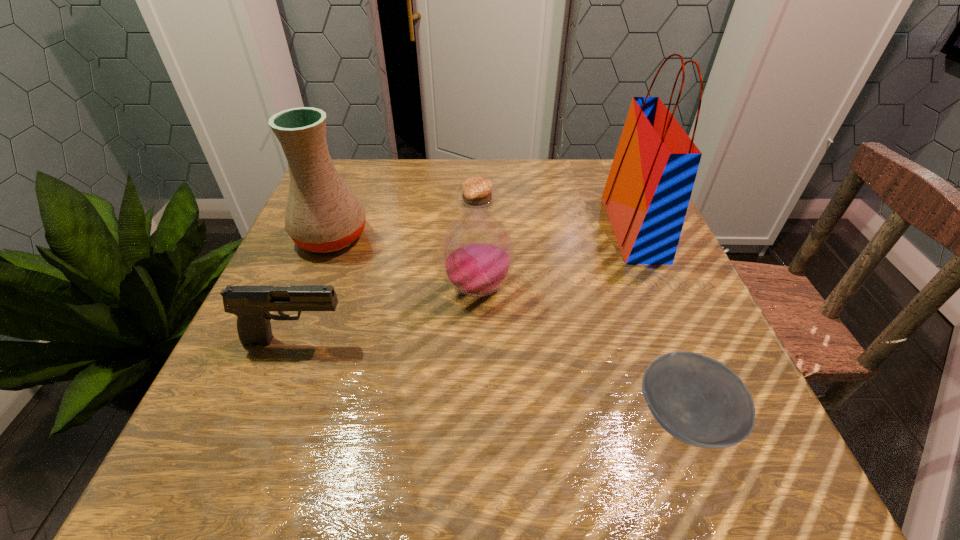
The height and width of the screenshot is (540, 960). In order to click on vacant point located between the shopping bag and the bowl in this screenshot , I will do 659,323.

This screenshot has height=540, width=960. What are the coordinates of `blank region between the third nearest object and the second nearest object` in the screenshot? It's located at (387, 314).

I want to click on free spot between the bowl and the tallest object, so click(x=659, y=323).

Find the location of a particular element. The image size is (960, 540). vacant area that lies between the pistol and the third tallest object is located at coordinates (387, 314).

What are the coordinates of `unoccupied position between the third object from left to right and the pottery` in the screenshot? It's located at (404, 263).

Find the location of `object that is the third closest to the third tallest object`. object that is the third closest to the third tallest object is located at coordinates (698, 400).

The height and width of the screenshot is (540, 960). What are the coordinates of `the second closest object to the pottery` in the screenshot? It's located at (251, 304).

The image size is (960, 540). I want to click on free location that satisfies the following two spatial constraints: 1. aim along the barrel of the second nearest object; 2. on the left side of the shortest object, so click(266, 418).

I want to click on vacant space that satisfies the following two spatial constraints: 1. aim along the barrel of the second nearest object; 2. on the left side of the bowl, so click(x=266, y=418).